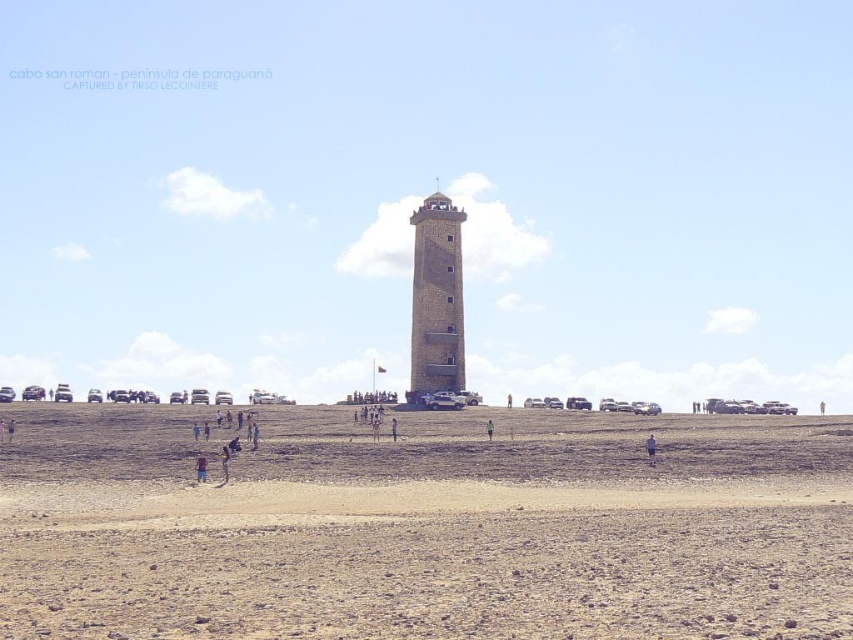
You are standing at the base of the tall cylindrical tower and want to take a photo. There are two points marked in the scene, point 1 at coordinates point (432,212) and point 2 at coordinates point (490,419). Which point is closer to you when you are facing the tower?

Point (490,419) is closer to you because it is less further to the camera than point (432,212).